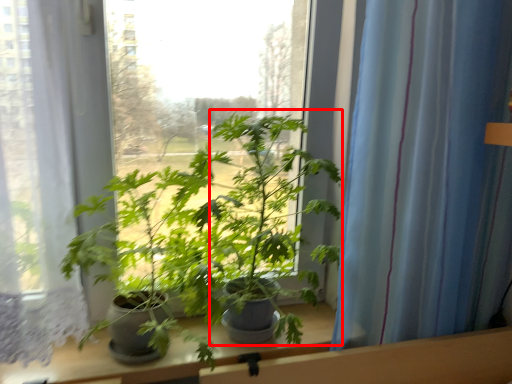
Question: From the image's perspective, what is the correct spatial positioning of parsley (annotated by the red box) in reference to curtain?

Choices:
 (A) below
 (B) above

Answer: (A)